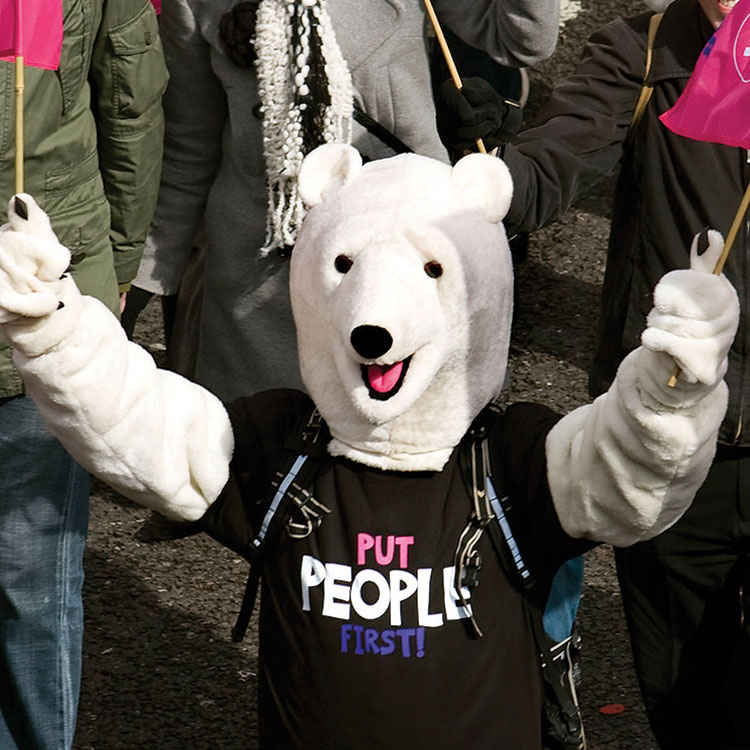
Find the location of `floor`. floor is located at coordinates (141, 607).